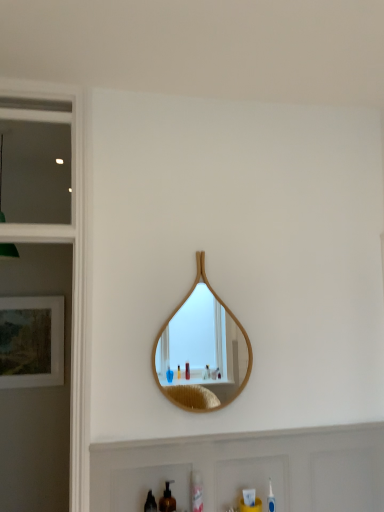
Describe the element at coordinates (167, 499) in the screenshot. This screenshot has width=384, height=512. I see `brown matte soap dispenser at lower center` at that location.

Image resolution: width=384 pixels, height=512 pixels. What do you see at coordinates (31, 341) in the screenshot? I see `matte wooden picture frame at left` at bounding box center [31, 341].

What do you see at coordinates (196, 492) in the screenshot? I see `clear plastic mouthwash at lower center, which is counted as the first mouthwash, starting from the back` at bounding box center [196, 492].

At what (x,y) coordinates should I click in order to perform the action: click on brown matte soap dispenser at lower center. Please return your answer as a coordinate pair (x, y). Image resolution: width=384 pixels, height=512 pixels. Looking at the image, I should click on tap(167, 499).

From the image's perspective, between black plastic mouthwash at lower center, acting as the 2th mouthwash starting from the back, and brown matte soap dispenser at lower center, which one is located above?

black plastic mouthwash at lower center, acting as the 2th mouthwash starting from the back, is shown above in the image.

Looking at this image, is black plastic mouthwash at lower center, acting as the 2th mouthwash starting from the back, facing away from brown matte soap dispenser at lower center?

black plastic mouthwash at lower center, acting as the 2th mouthwash starting from the back, does not have its back to brown matte soap dispenser at lower center.

Are black plastic mouthwash at lower center, acting as the first mouthwash starting from the left, and brown matte soap dispenser at lower center making contact?

Yes, black plastic mouthwash at lower center, acting as the first mouthwash starting from the left, is beside brown matte soap dispenser at lower center.

Which object is thinner, black plastic mouthwash at lower center, acting as the 2th mouthwash starting from the back, or brown matte soap dispenser at lower center?

Thinner between the two is black plastic mouthwash at lower center, acting as the 2th mouthwash starting from the back.

Which is more to the left, clear plastic mouthwash at lower center, placed as the second mouthwash when sorted from left to right, or white matte cabinet at lower center?

From the viewer's perspective, clear plastic mouthwash at lower center, placed as the second mouthwash when sorted from left to right, appears more on the left side.

In the image, is clear plastic mouthwash at lower center, placed as the second mouthwash when sorted from left to right, positioned in front of or behind white matte cabinet at lower center?

clear plastic mouthwash at lower center, placed as the second mouthwash when sorted from left to right, is positioned farther from the viewer than white matte cabinet at lower center.

Is clear plastic mouthwash at lower center, the 1th mouthwash in the right-to-left sequence, inside the boundaries of white matte cabinet at lower center, or outside?

clear plastic mouthwash at lower center, the 1th mouthwash in the right-to-left sequence, is contained in white matte cabinet at lower center.

Is clear plastic mouthwash at lower center, the 1th mouthwash in the right-to-left sequence, outside of black plastic mouthwash at lower center, the 1th mouthwash in the front-to-back sequence?

clear plastic mouthwash at lower center, the 1th mouthwash in the right-to-left sequence, is positioned outside black plastic mouthwash at lower center, the 1th mouthwash in the front-to-back sequence.

The height and width of the screenshot is (512, 384). I want to click on mouthwash that appears on the right of black plastic mouthwash at lower center, the 1th mouthwash in the front-to-back sequence, so click(196, 492).

Is clear plastic mouthwash at lower center, the 1th mouthwash in the right-to-left sequence, positioned far away from black plastic mouthwash at lower center, acting as the first mouthwash starting from the left?

No, clear plastic mouthwash at lower center, the 1th mouthwash in the right-to-left sequence, is not far away from black plastic mouthwash at lower center, acting as the first mouthwash starting from the left.

From the image's perspective, who appears lower, clear plastic mouthwash at lower center, the 1th mouthwash in the right-to-left sequence, or black plastic mouthwash at lower center, the 1th mouthwash in the front-to-back sequence?

clear plastic mouthwash at lower center, the 1th mouthwash in the right-to-left sequence.

Which is behind, point (224, 332) or point (9, 227)?

The point (224, 332) is more distant.

How different are the orientations of wooden mirror at center and clear glass window at upper left in degrees?

0.000489 degrees.

Who is bigger, wooden mirror at center or clear glass window at upper left?

clear glass window at upper left is bigger.

Is wooden mirror at center situated inside clear glass window at upper left or outside?

wooden mirror at center exists outside the volume of clear glass window at upper left.

Locate an element on the screen. window on the left of brown matte soap dispenser at lower center is located at coordinates (40, 231).

Based on the photo, between clear glass window at upper left and brown matte soap dispenser at lower center, which one has less height?

Standing shorter between the two is brown matte soap dispenser at lower center.

Does clear glass window at upper left contain brown matte soap dispenser at lower center?

No, clear glass window at upper left does not contain brown matte soap dispenser at lower center.

In the scene shown: Is brown matte soap dispenser at lower center next to white matte cabinet at lower center and touching it?

They are not placed beside each other.

Which is correct: brown matte soap dispenser at lower center is inside white matte cabinet at lower center, or outside of it?

The correct answer is: outside.

In the image, is brown matte soap dispenser at lower center on the left side or the right side of white matte cabinet at lower center?

Clearly, brown matte soap dispenser at lower center is on the left of white matte cabinet at lower center in the image.

Does brown matte soap dispenser at lower center turn towards white matte cabinet at lower center?

No.

Which of these two, brown matte soap dispenser at lower center or matte wooden picture frame at left, is wider?

With larger width is brown matte soap dispenser at lower center.

From the image's perspective, is brown matte soap dispenser at lower center above or below matte wooden picture frame at left?

Based on their image positions, brown matte soap dispenser at lower center is located beneath matte wooden picture frame at left.

Does brown matte soap dispenser at lower center have a greater height compared to matte wooden picture frame at left?

No, brown matte soap dispenser at lower center is not taller than matte wooden picture frame at left.

Choose the correct answer: Is brown matte soap dispenser at lower center inside matte wooden picture frame at left or outside it?

brown matte soap dispenser at lower center is spatially situated outside matte wooden picture frame at left.

Identify the location of soap dispenser to the right of black plastic mouthwash at lower center, which appears as the second mouthwash when viewed from the right. (167, 499).

The image size is (384, 512). What are the coordinates of `mouthwash behind the white matte cabinet at lower center` in the screenshot? It's located at (196, 492).

Based on the photo, when comparing their distances from white matte cabinet at lower center, does wooden mirror at center or clear plastic mouthwash at lower center, which is counted as the first mouthwash, starting from the back, seem closer?

clear plastic mouthwash at lower center, which is counted as the first mouthwash, starting from the back, is positioned closer to the anchor white matte cabinet at lower center.

From the image, which object appears to be farther from brown matte soap dispenser at lower center, matte wooden picture frame at left or black plastic mouthwash at lower center, which appears as the second mouthwash when viewed from the right?

Among the two, matte wooden picture frame at left is located further to brown matte soap dispenser at lower center.

Based on their spatial positions, is black plastic mouthwash at lower center, acting as the 2th mouthwash starting from the back, or brown matte soap dispenser at lower center closer to clear glass window at upper left?

Based on the image, brown matte soap dispenser at lower center appears to be nearer to clear glass window at upper left.

Which object lies further to the anchor point matte wooden picture frame at left, black plastic mouthwash at lower center, which appears as the second mouthwash when viewed from the right, or white matte cabinet at lower center?

black plastic mouthwash at lower center, which appears as the second mouthwash when viewed from the right, is further to matte wooden picture frame at left.

Estimate the real-world distances between objects in this image. Which object is closer to wooden mirror at center, brown matte soap dispenser at lower center or clear plastic mouthwash at lower center, marked as the second mouthwash in a front-to-back arrangement?

Among the two, clear plastic mouthwash at lower center, marked as the second mouthwash in a front-to-back arrangement, is located nearer to wooden mirror at center.

Based on their spatial positions, is clear plastic mouthwash at lower center, marked as the second mouthwash in a front-to-back arrangement, or white matte cabinet at lower center further from brown matte soap dispenser at lower center?

Based on the image, white matte cabinet at lower center appears to be further to brown matte soap dispenser at lower center.

Based on their spatial positions, is matte wooden picture frame at left or white matte cabinet at lower center further from black plastic mouthwash at lower center, the 1th mouthwash in the front-to-back sequence?

matte wooden picture frame at left is further to black plastic mouthwash at lower center, the 1th mouthwash in the front-to-back sequence.

Estimate the real-world distances between objects in this image. Which object is further from black plastic mouthwash at lower center, the 1th mouthwash in the front-to-back sequence, white matte cabinet at lower center or clear glass window at upper left?

clear glass window at upper left.

Where is `mouthwash that lies between clear glass window at upper left and clear plastic mouthwash at lower center, which is counted as the first mouthwash, starting from the back, from top to bottom`? mouthwash that lies between clear glass window at upper left and clear plastic mouthwash at lower center, which is counted as the first mouthwash, starting from the back, from top to bottom is located at coordinates (150, 503).

Locate an element on the screen. picture frame that lies between clear glass window at upper left and black plastic mouthwash at lower center, which appears as the second mouthwash when viewed from the right, from top to bottom is located at coordinates (31, 341).

The image size is (384, 512). Find the location of `cabinet between clear glass window at upper left and black plastic mouthwash at lower center, acting as the 2th mouthwash starting from the back, in the up-down direction`. cabinet between clear glass window at upper left and black plastic mouthwash at lower center, acting as the 2th mouthwash starting from the back, in the up-down direction is located at coordinates (247, 470).

Image resolution: width=384 pixels, height=512 pixels. Identify the location of mirror situated between matte wooden picture frame at left and white matte cabinet at lower center from left to right. (203, 353).